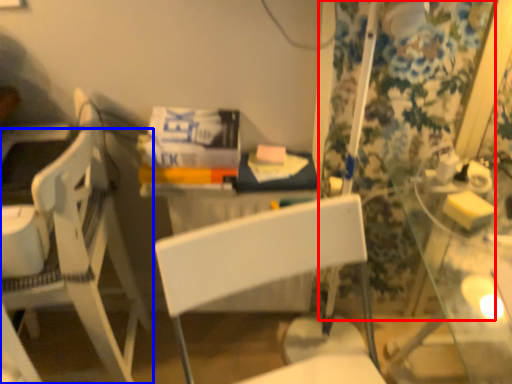
Question: Which of the following is the closest to the observer, curtain (highlighted by a red box) or chair (highlighted by a blue box)?

Choices:
 (A) curtain
 (B) chair

Answer: (B)